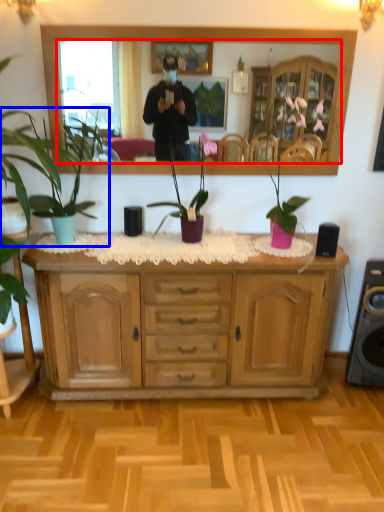
Question: Which point is closer to the camera, mirror (highlighted by a red box) or houseplant (highlighted by a blue box)?

Choices:
 (A) mirror
 (B) houseplant

Answer: (B)